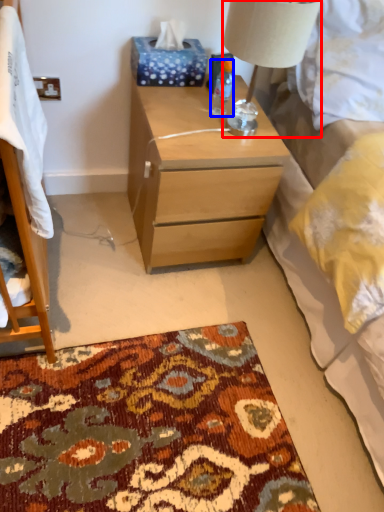
Question: Among these objects, which one is nearest to the camera, lamp (highlighted by a red box) or bottle (highlighted by a blue box)?

Choices:
 (A) lamp
 (B) bottle

Answer: (A)